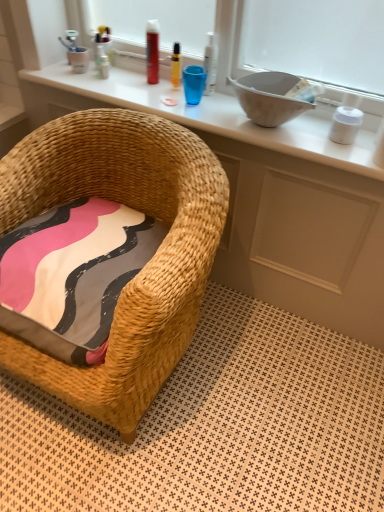
Find the location of a particular element. The width and height of the screenshot is (384, 512). unoccupied region to the right of white matte container at upper right, marked as the 1th toiletry in a right-to-left arrangement is located at coordinates (367, 139).